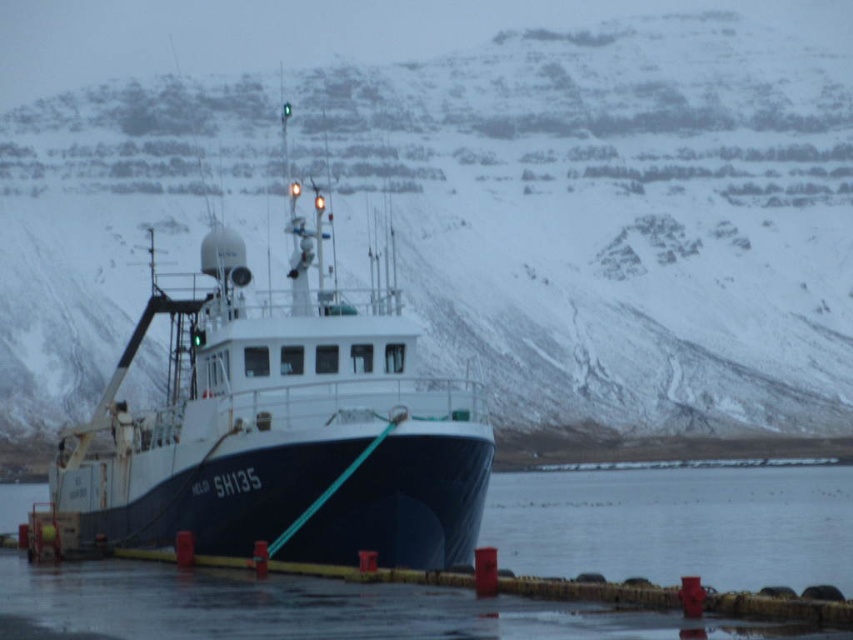
Question: Can you confirm if dark blue matte boat at center is smaller than black rubber water at lower center?

Choices:
 (A) yes
 (B) no

Answer: (B)

Question: Among these points, which one is nearest to the camera?

Choices:
 (A) (544, 621)
 (B) (309, 369)

Answer: (A)

Question: Considering the real-world distances, which object is closest to the snowy rock formation at upper center?

Choices:
 (A) dark blue matte boat at center
 (B) black rubber water at lower center

Answer: (A)

Question: Does snowy rock formation at upper center appear on the left side of dark blue matte boat at center?

Choices:
 (A) yes
 (B) no

Answer: (B)

Question: Is snowy rock formation at upper center above black rubber water at lower center?

Choices:
 (A) no
 (B) yes

Answer: (B)

Question: Estimate the real-world distances between objects in this image. Which object is farther from the snowy rock formation at upper center?

Choices:
 (A) black rubber water at lower center
 (B) dark blue matte boat at center

Answer: (A)